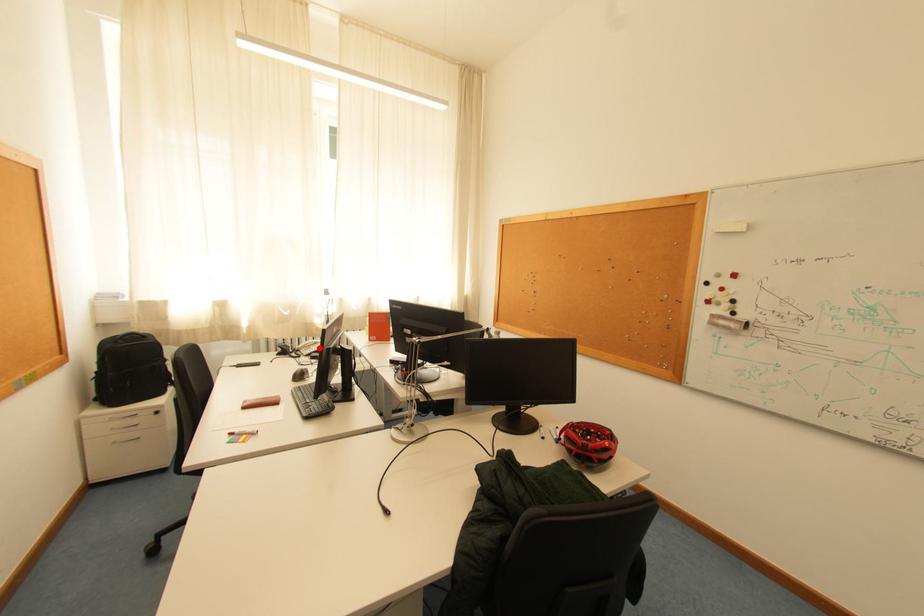
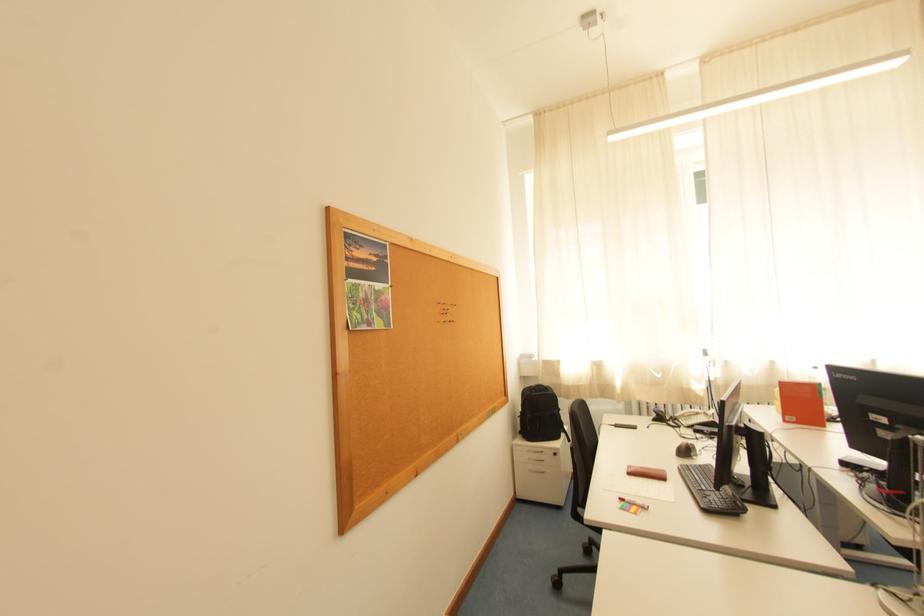
Question: I am providing you with two images of the same scene from different viewpoints. In image1, a red point is highlighted. Considering the same 3D point in image2, which of the following is correct?

Choices:
 (A) It is closer
 (B) It is farther

Answer: (A)